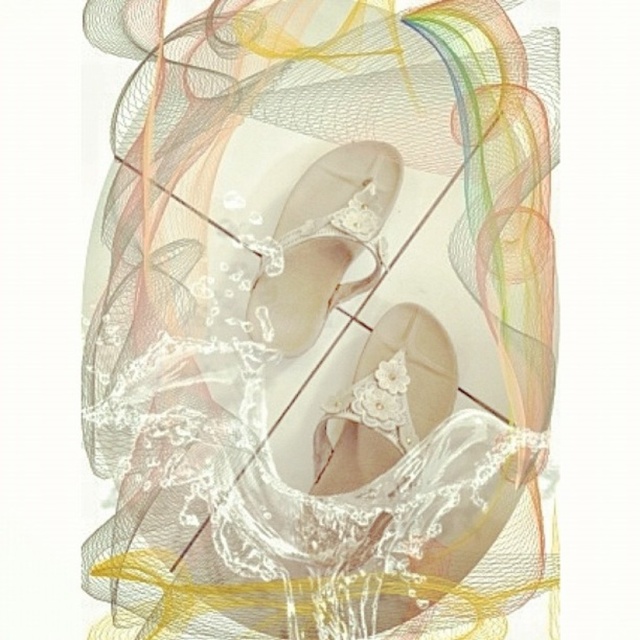
Who is shorter, pearl white satin sandal at center or pearl white lace sandal at center?

With less height is pearl white lace sandal at center.

You are a GUI agent. You are given a task and a screenshot of the screen. Output one action in this format:
    pyautogui.click(x=<x>, y=<y>)
    Task: Click on the pearl white satin sandal at center
    
    Given the screenshot: What is the action you would take?
    pyautogui.click(x=323, y=243)

Find the location of a particular element. pearl white satin sandal at center is located at coordinates (323, 243).